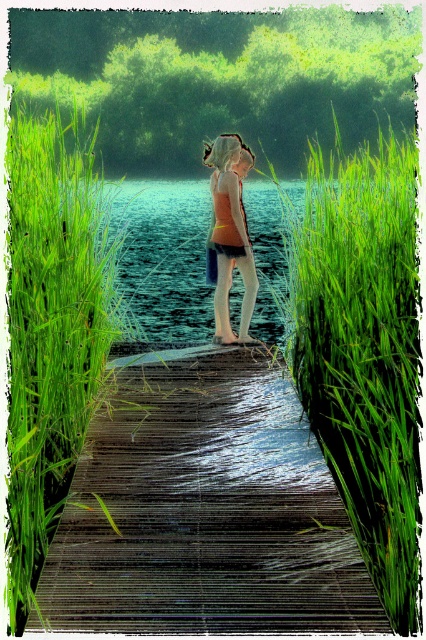
Question: Can you confirm if green leafy grass at center is positioned below green grass at left?

Choices:
 (A) no
 (B) yes

Answer: (B)

Question: Which point appears closest to the camera in this image?

Choices:
 (A) 25,582
 (B) 103,611
 (C) 411,461

Answer: (B)

Question: Is wooden dock at center behind matte orange tank top at center?

Choices:
 (A) yes
 (B) no

Answer: (B)

Question: Which point appears farthest from the camera in this image?

Choices:
 (A) (66, 362)
 (B) (314, 401)

Answer: (B)

Question: Does wooden dock at center appear under green grass at left?

Choices:
 (A) yes
 (B) no

Answer: (A)

Question: Which object appears farthest from the camera in this image?

Choices:
 (A) wooden dock at center
 (B) matte orange tank top at center
 (C) green grass at left

Answer: (B)